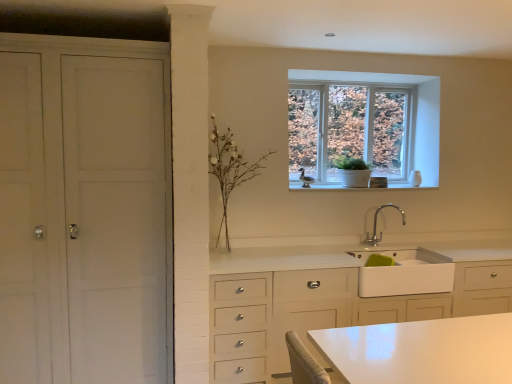
Question: Is white matte sink at lower center behind clear glass window at upper center?

Choices:
 (A) yes
 (B) no

Answer: (B)

Question: Can clear glass window at upper center be found inside white matte sink at lower center?

Choices:
 (A) yes
 (B) no

Answer: (B)

Question: From the image's perspective, is white matte sink at lower center beneath clear glass window at upper center?

Choices:
 (A) yes
 (B) no

Answer: (A)

Question: Does white matte sink at lower center come in front of clear glass window at upper center?

Choices:
 (A) yes
 (B) no

Answer: (A)

Question: Considering the relative sizes of white matte sink at lower center and clear glass window at upper center in the image provided, is white matte sink at lower center bigger than clear glass window at upper center?

Choices:
 (A) yes
 (B) no

Answer: (B)

Question: Is white matte sink at lower center bigger or smaller than white matte cabinet at left?

Choices:
 (A) small
 (B) big

Answer: (A)

Question: Is white matte sink at lower center to the left or to the right of white matte cabinet at left in the image?

Choices:
 (A) left
 (B) right

Answer: (B)

Question: Considering their positions, is white matte sink at lower center located in front of or behind white matte cabinet at left?

Choices:
 (A) front
 (B) behind

Answer: (B)

Question: In terms of width, does white matte sink at lower center look wider or thinner when compared to white matte cabinet at left?

Choices:
 (A) thin
 (B) wide

Answer: (A)

Question: From a real-world perspective, relative to silver metallic faucet at upper center, is white matte plant at center vertically above or below?

Choices:
 (A) above
 (B) below

Answer: (A)

Question: Does point (236, 148) appear closer or farther from the camera than point (376, 211)?

Choices:
 (A) farther
 (B) closer

Answer: (B)

Question: Considering the positions of white matte plant at center and silver metallic faucet at upper center in the image, is white matte plant at center taller or shorter than silver metallic faucet at upper center?

Choices:
 (A) short
 (B) tall

Answer: (B)

Question: Is white matte plant at center wider or thinner than silver metallic faucet at upper center?

Choices:
 (A) thin
 (B) wide

Answer: (B)

Question: From the image's perspective, is white matte plant at center located above or below white matte cabinet at left?

Choices:
 (A) above
 (B) below

Answer: (A)

Question: Is point (226, 226) closer or farther from the camera than point (24, 196)?

Choices:
 (A) farther
 (B) closer

Answer: (A)